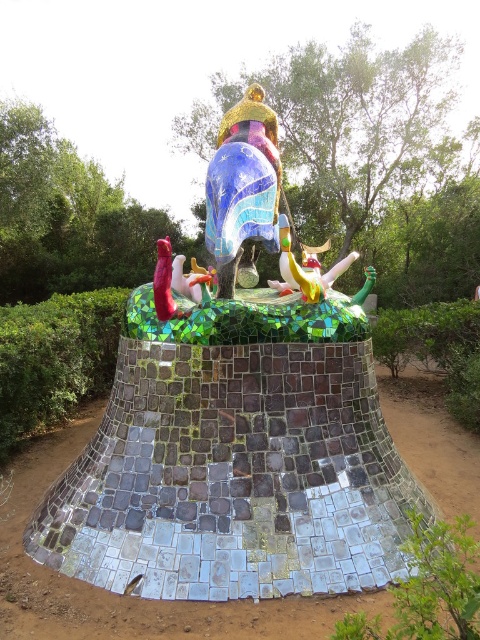
Is point (159, 513) positioned before point (312, 266)?

Yes, point (159, 513) is closer to viewer.

Between mosaic mosaic horse at center and shiny yellow and green toy at center, which one appears on the left side from the viewer's perspective?

Positioned to the left is mosaic mosaic horse at center.

Where is `mosaic mosaic horse at center`? The height and width of the screenshot is (640, 480). mosaic mosaic horse at center is located at coordinates (235, 426).

Identify the location of mosaic mosaic horse at center. The image size is (480, 640). (235, 426).